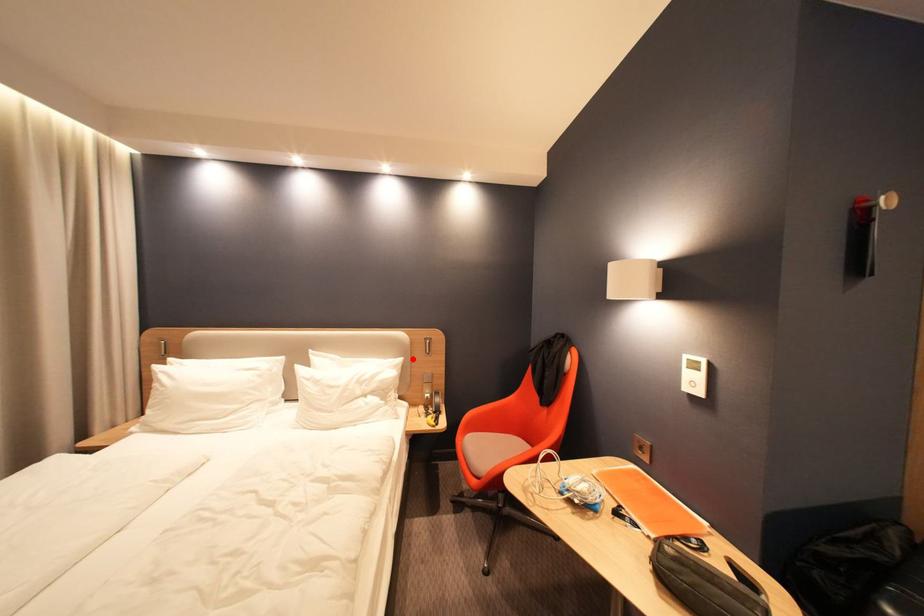
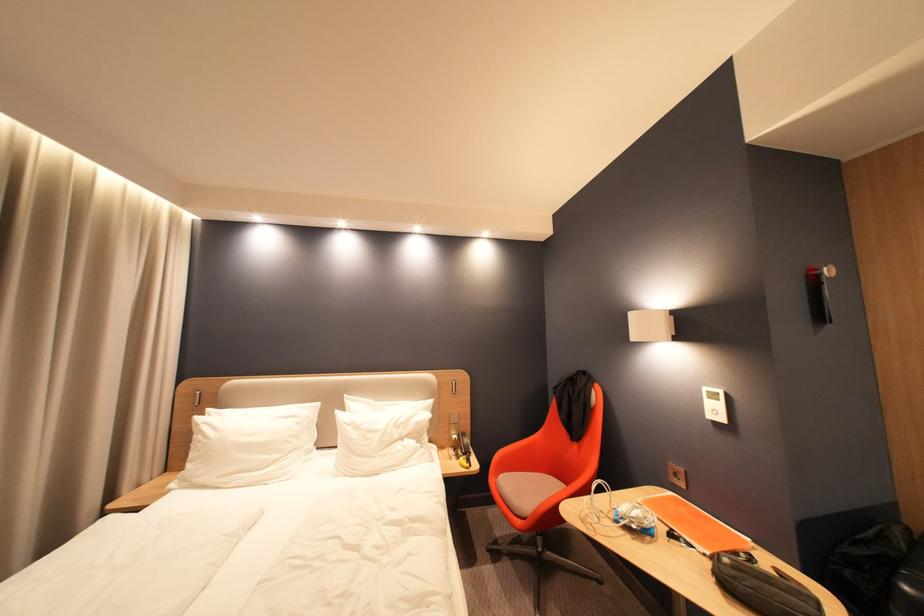
Where in the second image is the point corresponding to the highlighted location from the first image?

(443, 400)